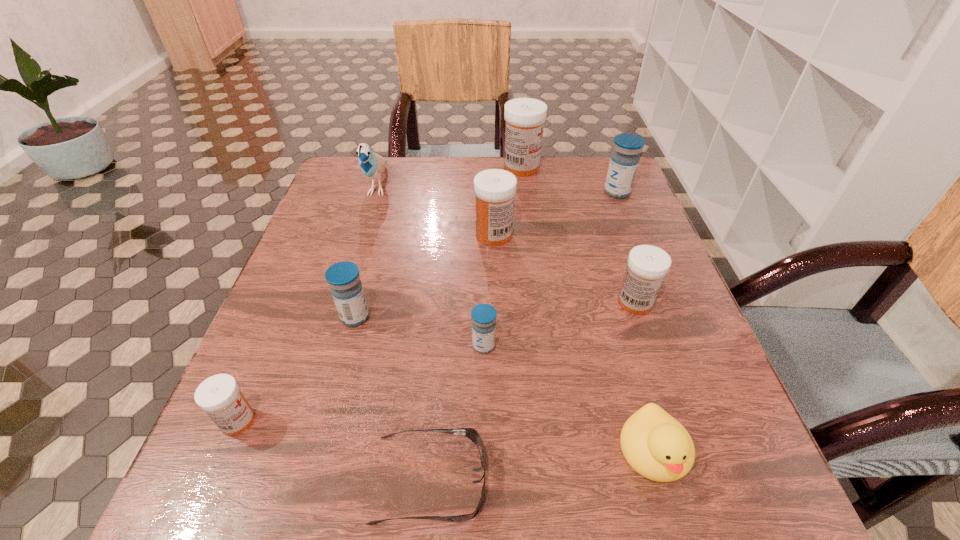
The image size is (960, 540). In order to click on the second biggest blue medicine in this screenshot , I will do `click(343, 277)`.

Identify the location of the seventh farthest object. (483, 315).

Locate an element on the screen. the second nearest medicine is located at coordinates [483, 315].

This screenshot has height=540, width=960. Find the location of `the nearest medicine`. the nearest medicine is located at coordinates (219, 396).

Find the location of a particular element. the nearest white medicine is located at coordinates (219, 396).

Locate an element on the screen. This screenshot has height=540, width=960. duckling is located at coordinates (658, 447).

Find the location of a particular element. sunglasses is located at coordinates (471, 433).

The height and width of the screenshot is (540, 960). Find the location of `vacant space positioned 0.080m on the left of the farthest white medicine`. vacant space positioned 0.080m on the left of the farthest white medicine is located at coordinates (474, 167).

Locate an element on the screen. The image size is (960, 540). vacant space located 0.260m at the face of the blue bird is located at coordinates (348, 284).

The width and height of the screenshot is (960, 540). Find the location of `vacant space located on the left of the biggest blue medicine`. vacant space located on the left of the biggest blue medicine is located at coordinates (524, 192).